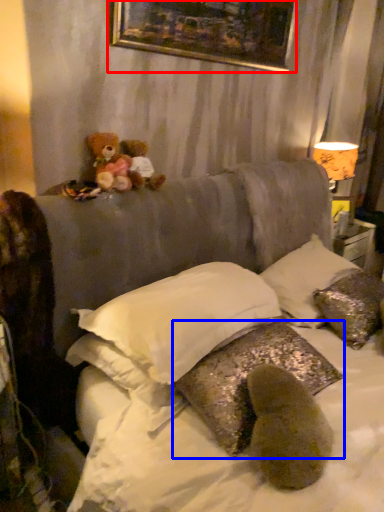
Question: Which point is further to the camera, picture frame (highlighted by a red box) or pillow (highlighted by a blue box)?

Choices:
 (A) picture frame
 (B) pillow

Answer: (A)